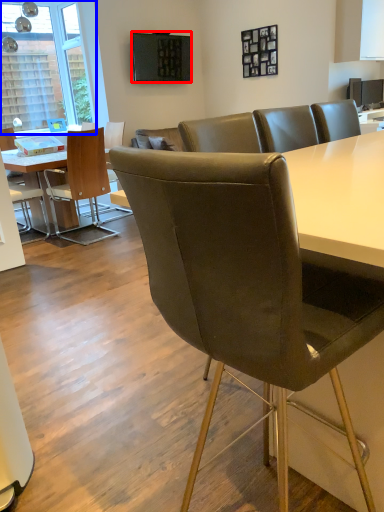
Question: Which point is closer to the camera, television (highlighted by a red box) or window (highlighted by a blue box)?

Choices:
 (A) television
 (B) window

Answer: (A)